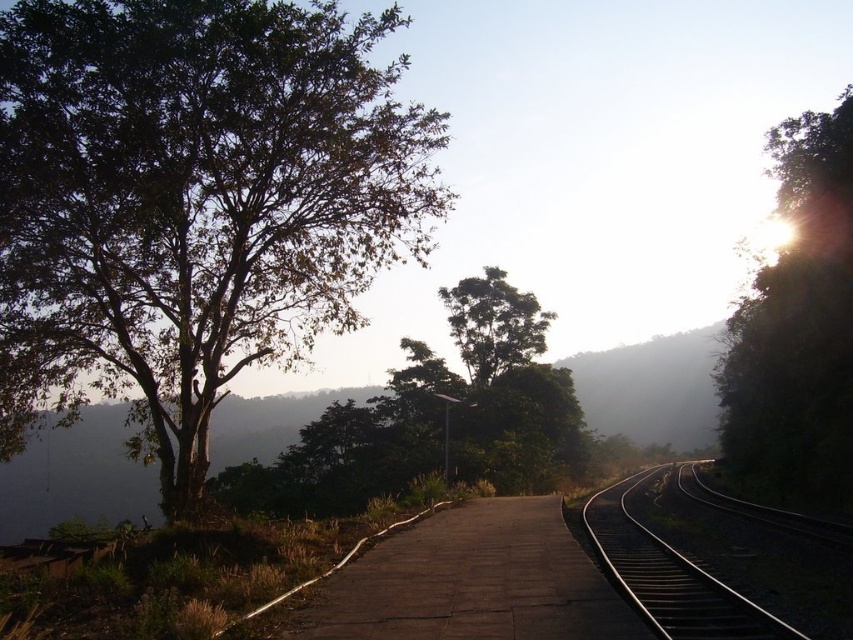
You are a photographer trying to capture the railway tracks in the distance. You want to ensure both the green leafy tree at left and the green leafy tree at center are visible in your shot. Which tree should you position closer to the edge of your frame to avoid blocking the tracks?

The green leafy tree at left is bigger than the green leafy tree at center, so you should position the larger green leafy tree at left closer to the edge of your frame to prevent it from blocking the tracks while still including both trees in the shot.

You are standing on the platform at the railway station and see two points marked on the tracks. The first point is at coordinate point(635, 536) and the second is at point(595, 618). If you want to walk towards the point that is closer to you, which coordinate should you head towards?

You should head towards point(595, 618) because it is closer to you than point(635, 536), which is further away.